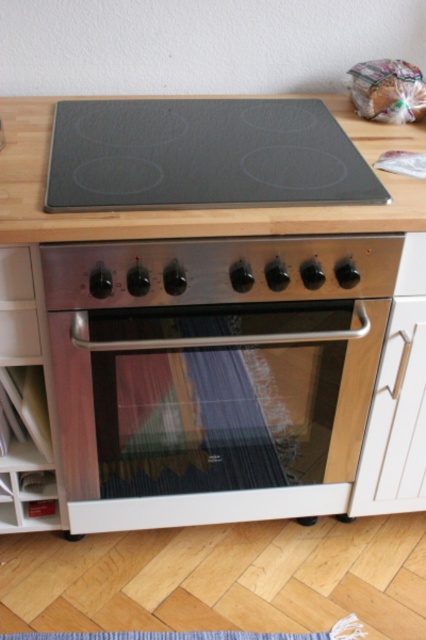
Question: Is satin silver oven at center positioned before white wood drawer at lower right?

Choices:
 (A) no
 (B) yes

Answer: (B)

Question: Estimate the real-world distances between objects in this image. Which object is farther from the white wood drawer at lower right?

Choices:
 (A) white glossy drawer at lower left
 (B) satin silver oven at center

Answer: (A)

Question: Does black glass cooktop at center have a greater width compared to white wood drawer at lower right?

Choices:
 (A) yes
 (B) no

Answer: (A)

Question: Which point appears farthest from the camera in this image?

Choices:
 (A) (x=114, y=122)
 (B) (x=161, y=445)
 (C) (x=2, y=348)
 (D) (x=409, y=378)

Answer: (A)

Question: Which of the following is the closest to the observer?

Choices:
 (A) (385, 406)
 (B) (112, 449)

Answer: (B)

Question: Can you confirm if black glass cooktop at center is smaller than white wood drawer at lower right?

Choices:
 (A) no
 (B) yes

Answer: (A)